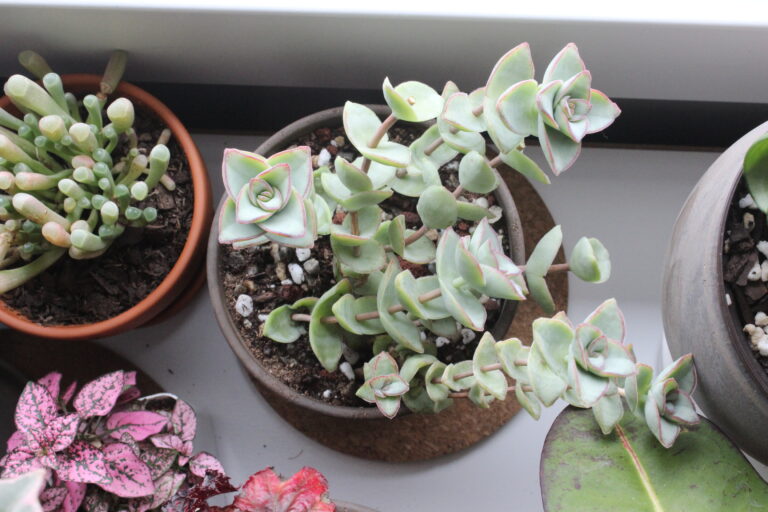
Locate an element on the screen. green plant is located at coordinates pyautogui.click(x=50, y=130), pyautogui.click(x=431, y=209), pyautogui.click(x=756, y=175), pyautogui.click(x=624, y=464).